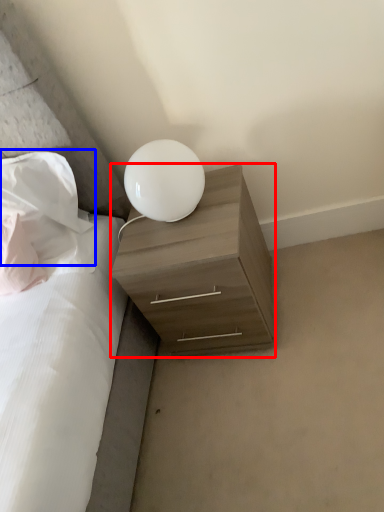
Question: Among these objects, which one is farthest to the camera, nightstand (highlighted by a red box) or pillow (highlighted by a blue box)?

Choices:
 (A) nightstand
 (B) pillow

Answer: (B)